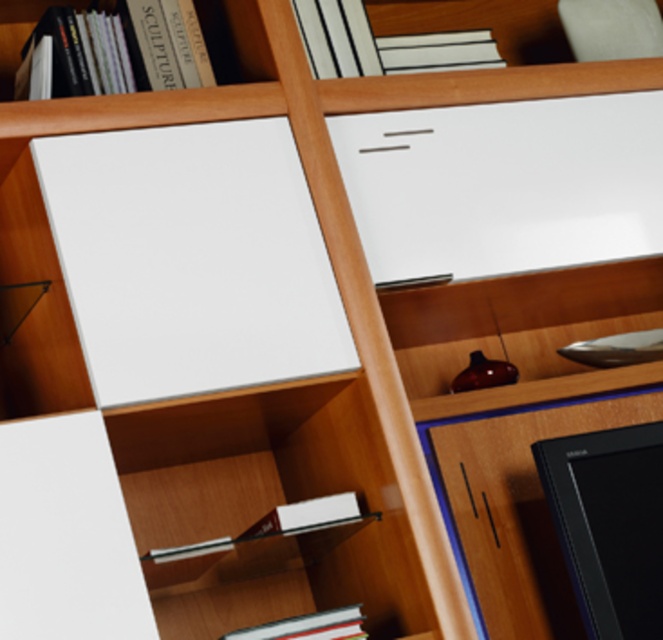
You are an interior designer planning to hang a new picture. You see the white matte board at upper left in the scene. What are the coordinates of its position?

The white matte board at upper left is located at coordinates point (192, 259).

What are the coordinates of the white matte board at upper left in the image?

The white matte board at upper left is located at coordinates (192, 259).

Consider the image. You are setting up a display on a shelf and need to place the black glossy monitor at lower right and the white glossy book at lower center. Which object requires more horizontal space on the shelf?

The white glossy book at lower center requires more horizontal space because it has a greater width than the black glossy monitor at lower right.